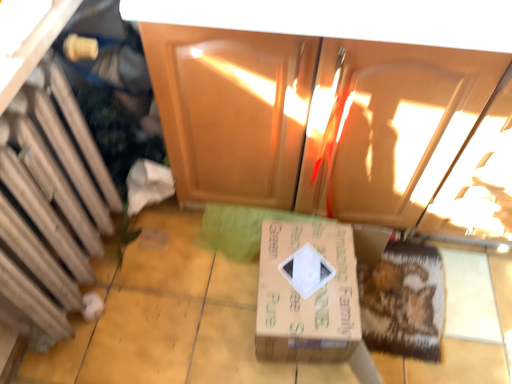
Measure the distance between point (458, 130) and camera.

Point (458, 130) and camera are 1.05 meters apart.

The image size is (512, 384). What do you see at coordinates (44, 185) in the screenshot?
I see `wooden cabinet at left, which appears as the 1th cabinetry when viewed from the left` at bounding box center [44, 185].

This screenshot has width=512, height=384. In order to click on wooden cabinet at left, placed as the second cabinetry when sorted from right to left in this screenshot , I will do `click(44, 185)`.

Where is `matte wood cabinet at center, the 2th cabinetry viewed from the left`? matte wood cabinet at center, the 2th cabinetry viewed from the left is located at coordinates coord(314,118).

Which is behind, point (111, 202) or point (460, 113)?

The point (111, 202) is farther from the camera.

Is wooden cabinet at left, which appears as the 1th cabinetry when viewed from the left, not within matte wood cabinet at center, acting as the first cabinetry starting from the right?

Yes, wooden cabinet at left, which appears as the 1th cabinetry when viewed from the left, is outside of matte wood cabinet at center, acting as the first cabinetry starting from the right.

Find the location of a particular element. cabinetry lying in front of the matte wood cabinet at center, the 2th cabinetry viewed from the left is located at coordinates (44, 185).

Which object is further away from the camera taking this photo, matte wood cabinet at center, the 2th cabinetry viewed from the left, or wooden cabinet at left, which appears as the 1th cabinetry when viewed from the left?

matte wood cabinet at center, the 2th cabinetry viewed from the left, is further from the camera.

From the image's perspective, who appears lower, matte wood cabinet at center, acting as the first cabinetry starting from the right, or wooden cabinet at left, placed as the second cabinetry when sorted from right to left?

wooden cabinet at left, placed as the second cabinetry when sorted from right to left, appears lower in the image.

Is wooden cabinet at left, placed as the second cabinetry when sorted from right to left, at the back of matte wood cabinet at center, the 2th cabinetry viewed from the left?

No, matte wood cabinet at center, the 2th cabinetry viewed from the left,'s orientation is not away from wooden cabinet at left, placed as the second cabinetry when sorted from right to left.

Is matte wood cabinet at center, acting as the first cabinetry starting from the right, next to wooden cabinet at left, which appears as the 1th cabinetry when viewed from the left?

No.

Does brown cardboard box at center contain matte wood cabinet at center, the 2th cabinetry viewed from the left?

No, matte wood cabinet at center, the 2th cabinetry viewed from the left, is not inside brown cardboard box at center.

Considering the positions of points (307, 224) and (146, 40), is point (307, 224) closer to camera compared to point (146, 40)?

No, (307, 224) is further to viewer.

From a real-world perspective, is brown cardboard box at center located beneath matte wood cabinet at center, the 2th cabinetry viewed from the left?

Yes, from a real-world perspective, brown cardboard box at center is below matte wood cabinet at center, the 2th cabinetry viewed from the left.

Could you tell me if brown cardboard box at center is turned towards matte wood cabinet at center, the 2th cabinetry viewed from the left?

No, brown cardboard box at center is not turned towards matte wood cabinet at center, the 2th cabinetry viewed from the left.

Is wooden cabinet at left, placed as the second cabinetry when sorted from right to left, facing away from brown cardboard box at center?

wooden cabinet at left, placed as the second cabinetry when sorted from right to left, does not have its back to brown cardboard box at center.

Based on the photo, does wooden cabinet at left, placed as the second cabinetry when sorted from right to left, have a greater width compared to brown cardboard box at center?

No, wooden cabinet at left, placed as the second cabinetry when sorted from right to left, is not wider than brown cardboard box at center.

Which is nearer, [11,304] or [259,359]?

Point [11,304]

Is brown cardboard box at center directly adjacent to wooden cabinet at left, placed as the second cabinetry when sorted from right to left?

brown cardboard box at center and wooden cabinet at left, placed as the second cabinetry when sorted from right to left, are clearly separated.

Does point (263, 242) come in front of point (9, 132)?

No, (263, 242) is further to viewer.

In the scene shown: From a real-world perspective, does brown cardboard box at center sit lower than wooden cabinet at left, placed as the second cabinetry when sorted from right to left?

Correct, in the physical world, brown cardboard box at center is lower than wooden cabinet at left, placed as the second cabinetry when sorted from right to left.

Could you tell me if matte wood cabinet at center, the 2th cabinetry viewed from the left, is turned towards brown cardboard box at center?

Yes, matte wood cabinet at center, the 2th cabinetry viewed from the left, faces towards brown cardboard box at center.

Identify the location of cabinetry to the right of brown cardboard box at center. (314, 118).

Which object is more forward, matte wood cabinet at center, acting as the first cabinetry starting from the right, or brown cardboard box at center?

matte wood cabinet at center, acting as the first cabinetry starting from the right, is in front.

Which object is positioned more to the right, matte wood cabinet at center, acting as the first cabinetry starting from the right, or brown cardboard box at center?

Positioned to the right is matte wood cabinet at center, acting as the first cabinetry starting from the right.

You are a GUI agent. You are given a task and a screenshot of the screen. Output one action in this format:
    pyautogui.click(x=<x>, y=<y>)
    Task: Click on the cabinetry on the right side of wooden cabinet at left, placed as the second cabinetry when sorted from right to left
    The width and height of the screenshot is (512, 384).
    Given the screenshot: What is the action you would take?
    pyautogui.click(x=314, y=118)

At what (x,y) coordinates should I click in order to perform the action: click on cabinetry behind the wooden cabinet at left, placed as the second cabinetry when sorted from right to left. Please return your answer as a coordinate pair (x, y). The width and height of the screenshot is (512, 384). Looking at the image, I should click on pos(314,118).

When comparing their distances from wooden cabinet at left, which appears as the 1th cabinetry when viewed from the left, does brown cardboard box at center or matte wood cabinet at center, acting as the first cabinetry starting from the right, seem further?

Based on the image, brown cardboard box at center appears to be further to wooden cabinet at left, which appears as the 1th cabinetry when viewed from the left.

Which object lies further to the anchor point matte wood cabinet at center, the 2th cabinetry viewed from the left, brown cardboard box at center or wooden cabinet at left, placed as the second cabinetry when sorted from right to left?

wooden cabinet at left, placed as the second cabinetry when sorted from right to left.

In the scene shown: When comparing their distances from matte wood cabinet at center, the 2th cabinetry viewed from the left, does wooden cabinet at left, placed as the second cabinetry when sorted from right to left, or brown cardboard box at center seem further?

wooden cabinet at left, placed as the second cabinetry when sorted from right to left.

Based on their spatial positions, is wooden cabinet at left, which appears as the 1th cabinetry when viewed from the left, or matte wood cabinet at center, the 2th cabinetry viewed from the left, further from brown cardboard box at center?

The object further to brown cardboard box at center is wooden cabinet at left, which appears as the 1th cabinetry when viewed from the left.

Looking at the image, which one is located closer to brown cardboard box at center, matte wood cabinet at center, acting as the first cabinetry starting from the right, or wooden cabinet at left, which appears as the 1th cabinetry when viewed from the left?

Based on the image, matte wood cabinet at center, acting as the first cabinetry starting from the right, appears to be nearer to brown cardboard box at center.

Which object lies further to the anchor point wooden cabinet at left, which appears as the 1th cabinetry when viewed from the left, matte wood cabinet at center, acting as the first cabinetry starting from the right, or brown cardboard box at center?

Based on the image, brown cardboard box at center appears to be further to wooden cabinet at left, which appears as the 1th cabinetry when viewed from the left.

This screenshot has height=384, width=512. Find the location of `box between wooden cabinet at left, which appears as the 1th cabinetry when viewed from the left, and matte wood cabinet at center, the 2th cabinetry viewed from the left, from left to right`. box between wooden cabinet at left, which appears as the 1th cabinetry when viewed from the left, and matte wood cabinet at center, the 2th cabinetry viewed from the left, from left to right is located at coordinates (307, 293).